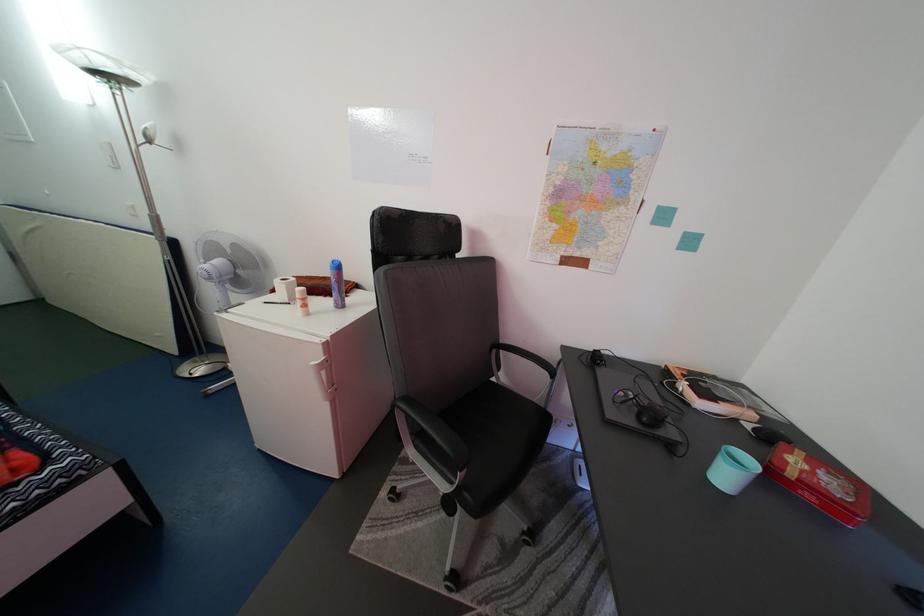
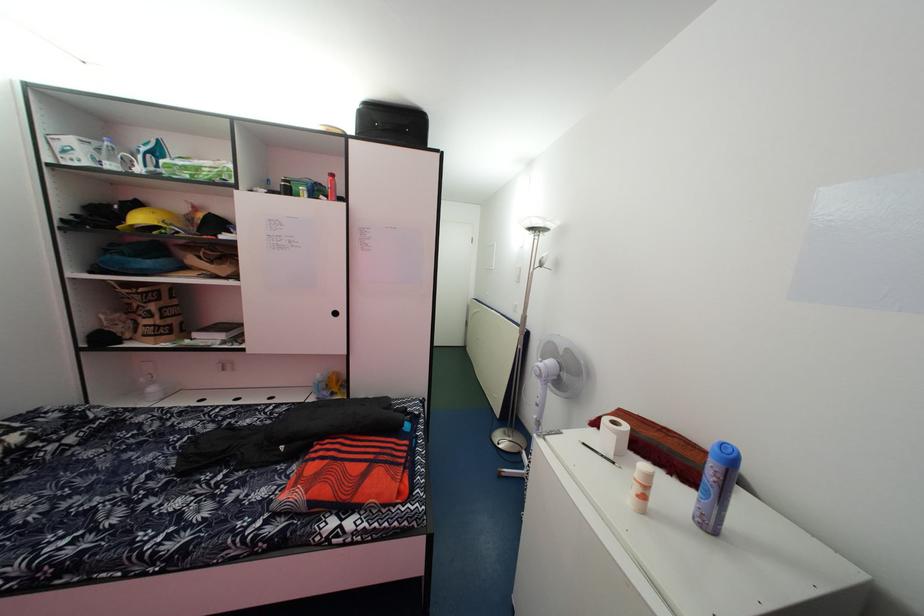
The point at (347,275) is marked in the first image. Where is the corresponding point in the second image?

(738, 466)